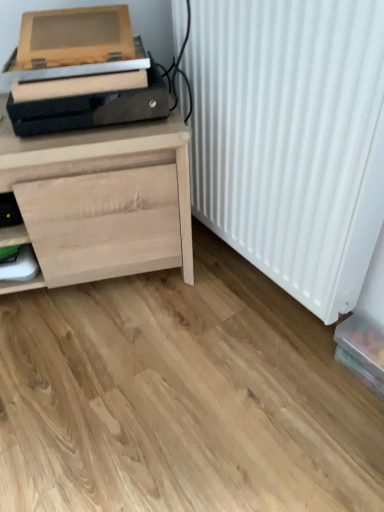
The height and width of the screenshot is (512, 384). In order to click on free spot in front of translucent plastic box at lower right in this screenshot , I will do `click(356, 433)`.